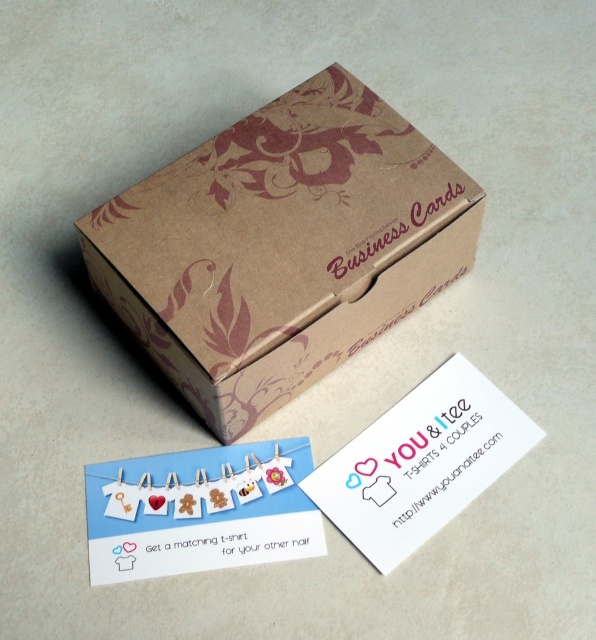
This screenshot has height=640, width=596. What do you see at coordinates (281, 246) in the screenshot? I see `brown kraft paper business cards at center` at bounding box center [281, 246].

Between point (414, 193) and point (231, 545), which one is positioned in front?

Point (231, 545) is in front.

I want to click on brown kraft paper business cards at center, so click(x=281, y=246).

Does cardboard paper card at center have a greater height compared to white paper business card at center?

In fact, cardboard paper card at center may be shorter than white paper business card at center.

Can you confirm if cardboard paper card at center is positioned below white paper business card at center?

Yes, cardboard paper card at center is below white paper business card at center.

Between point (272, 557) and point (386, 444), which one is positioned behind?

Point (386, 444)

You are a GUI agent. You are given a task and a screenshot of the screen. Output one action in this format:
    pyautogui.click(x=<x>, y=<y>)
    Task: Click on the cardboard paper card at center
    
    Given the screenshot: What is the action you would take?
    pyautogui.click(x=200, y=509)

Can you confirm if brown kraft paper business cards at center is shorter than white paper business card at center?

In fact, brown kraft paper business cards at center may be taller than white paper business card at center.

Which is behind, point (336, 212) or point (477, 428)?

Point (477, 428)

Describe the element at coordinates (281, 246) in the screenshot. I see `brown kraft paper business cards at center` at that location.

Locate an element on the screen. The width and height of the screenshot is (596, 640). brown kraft paper business cards at center is located at coordinates (281, 246).